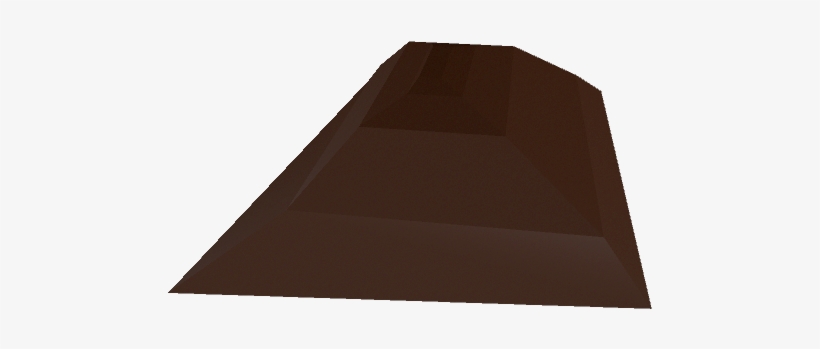
You are a GUI agent. You are given a task and a screenshot of the screen. Output one action in this format:
    pyautogui.click(x=<x>, y=<y>)
    Task: Click on the corners
    Image resolution: width=820 pixels, height=349 pixels.
    Given the screenshot: What is the action you would take?
    pyautogui.click(x=650, y=306), pyautogui.click(x=599, y=89), pyautogui.click(x=171, y=288)